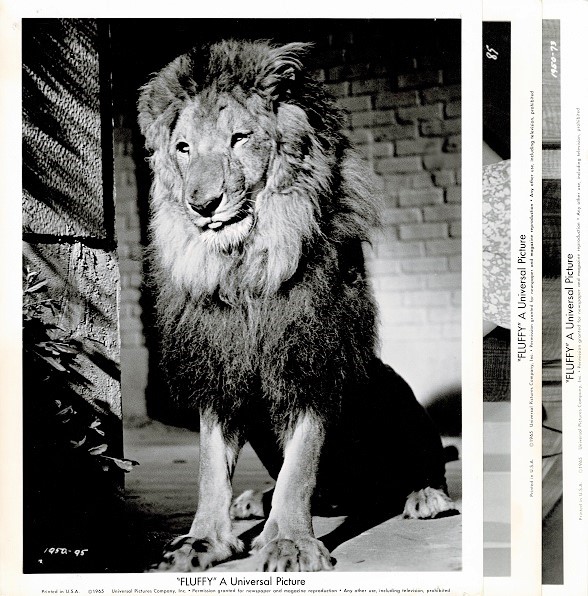
Locate an element on the screen. The image size is (588, 596). shadow on wall is located at coordinates (39, 105).